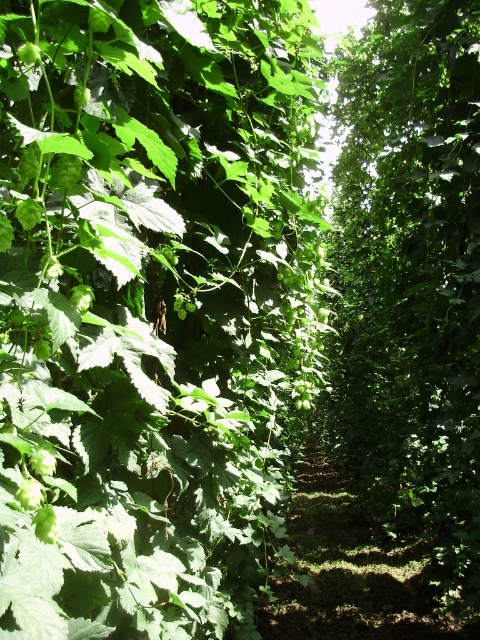
Is green leafy plant at center below green leafy tree at center?

Incorrect, green leafy plant at center is not positioned below green leafy tree at center.

The image size is (480, 640). I want to click on green leafy plant at center, so click(x=152, y=308).